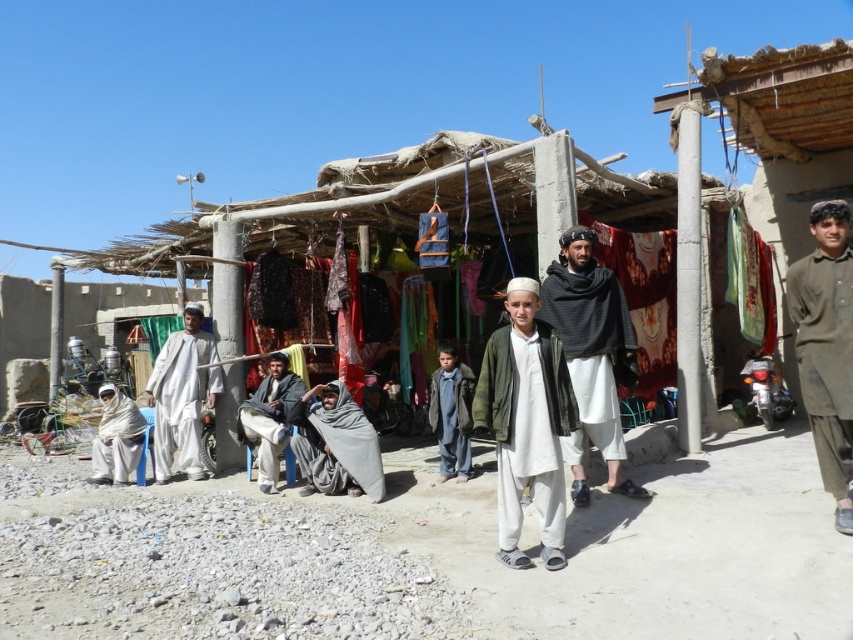
Is green matte jacket at center further to the viewer compared to gray woolen robe at lower center?

No.

What do you see at coordinates (526, 426) in the screenshot?
I see `green matte jacket at center` at bounding box center [526, 426].

This screenshot has width=853, height=640. What do you see at coordinates (526, 426) in the screenshot? I see `green matte jacket at center` at bounding box center [526, 426].

Locate an element on the screen. green matte jacket at center is located at coordinates (526, 426).

Who is higher up, brown cotton shirt at right or dark gray fabric at center?

brown cotton shirt at right

Does brown cotton shirt at right have a lesser height compared to dark gray fabric at center?

Incorrect, brown cotton shirt at right's height does not fall short of dark gray fabric at center's.

Is point (838, 237) positioned after point (299, 392)?

No, it is not.

Identify the location of brown cotton shirt at right. (827, 348).

Is green matte jacket at center positioned behind dark gray woolen shawl at center?

No, it is not.

Can you confirm if green matte jacket at center is wider than dark gray woolen shawl at center?

In fact, green matte jacket at center might be narrower than dark gray woolen shawl at center.

What do you see at coordinates (526, 426) in the screenshot?
I see `green matte jacket at center` at bounding box center [526, 426].

Where is `green matte jacket at center`? green matte jacket at center is located at coordinates (526, 426).